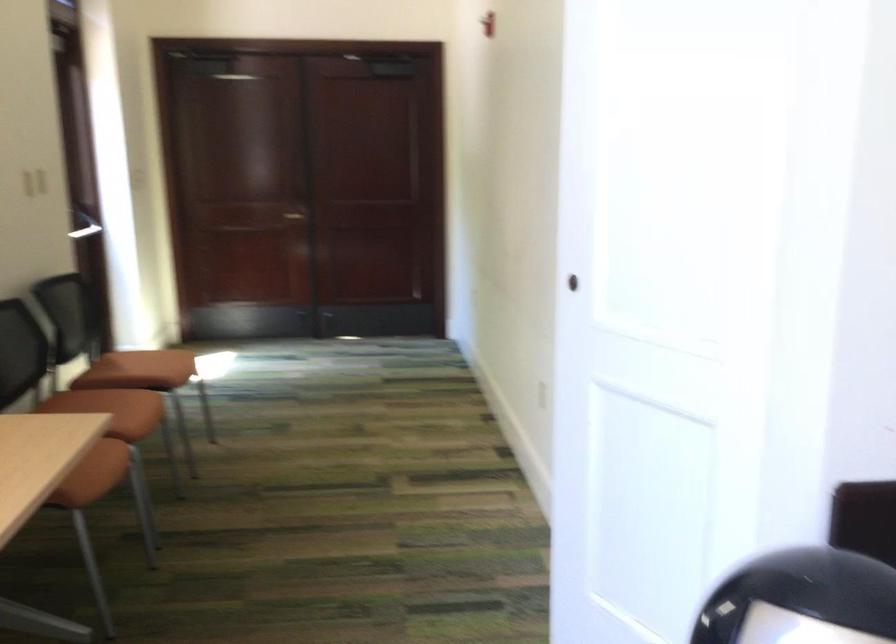
Image resolution: width=896 pixels, height=644 pixels. I want to click on light switch, so click(x=541, y=395).